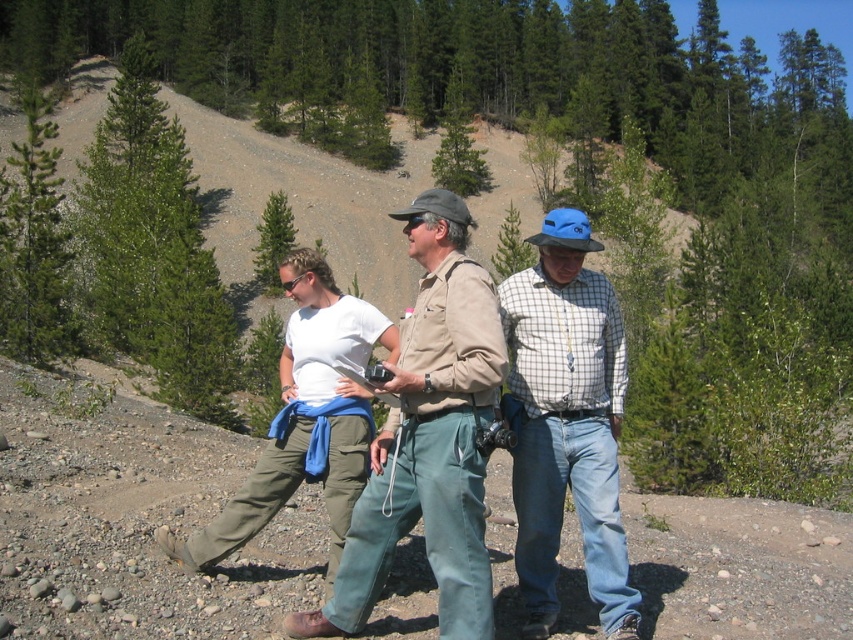
You are a photographer positioned on the path and want to capture both the khaki cotton shirt at center and the white cotton shirt at center in a single frame. Which of the two shirts should you focus on first to ensure both are in the frame?

The khaki cotton shirt at center has a lesser height compared to white cotton shirt at center, so you should focus on the white cotton shirt at center first to ensure both are in the frame.

You are a photographer positioned on the path and want to take a photo of the two people at the center wearing khaki cotton shirt at center and white cotton shirt at center. Which one will appear larger in the photo?

The khaki cotton shirt at center will appear larger in the photo because it is closer to the viewer than the white cotton shirt at center.